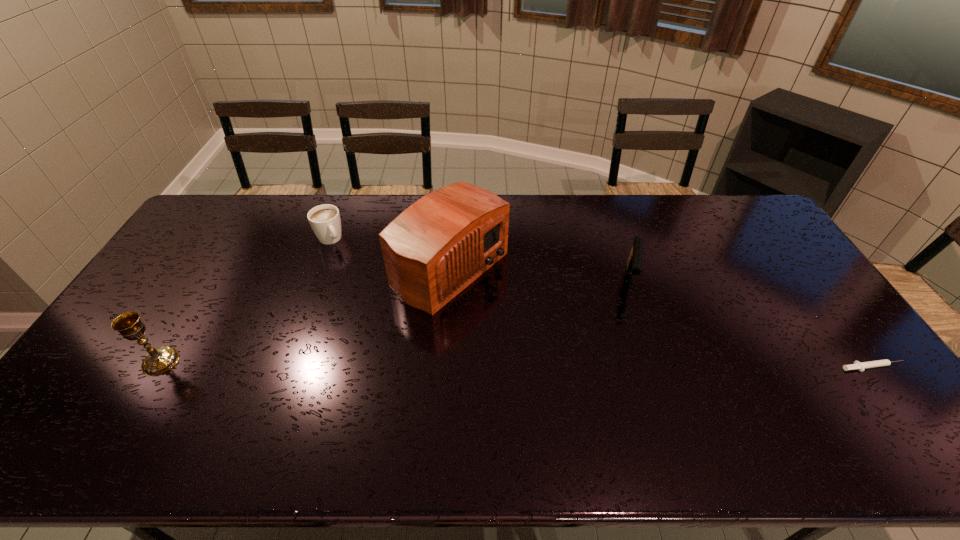
Identify the location of chalice. This screenshot has height=540, width=960. (158, 361).

I want to click on the fourth shortest object, so click(x=158, y=361).

The height and width of the screenshot is (540, 960). I want to click on the rightmost object, so click(x=861, y=366).

Locate an element on the screen. The height and width of the screenshot is (540, 960). the shortest object is located at coordinates [x=861, y=366].

In order to click on the fourth object from right to left in this screenshot , I will do `click(325, 221)`.

Find the location of a particular element. the second shortest object is located at coordinates click(x=325, y=221).

The width and height of the screenshot is (960, 540). In order to click on the third shortest object in this screenshot , I will do `click(634, 262)`.

Where is `pistol`? The height and width of the screenshot is (540, 960). pistol is located at coordinates (634, 262).

Where is `radio receiver`? radio receiver is located at coordinates (435, 248).

The height and width of the screenshot is (540, 960). Find the location of `the third object from left to right`. the third object from left to right is located at coordinates (435, 248).